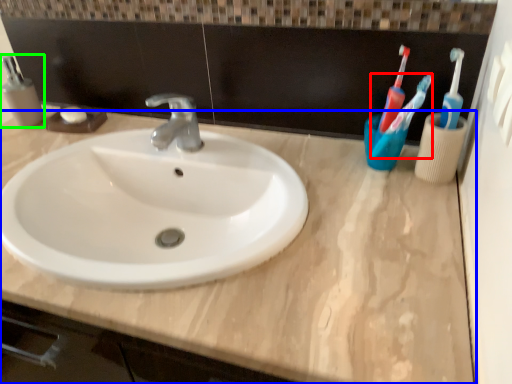
Question: Which object is the closest to the toothbrush (highlighted by a red box)? Choose among these: counter top (highlighted by a blue box) or mouthwash (highlighted by a green box).

Choices:
 (A) counter top
 (B) mouthwash

Answer: (A)